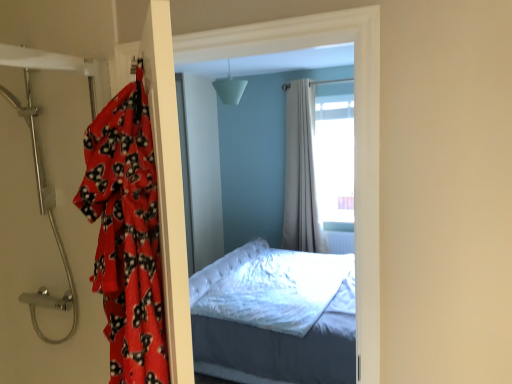
Question: From the image's perspective, is fluffy red blanket at left below beige fabric curtain at center?

Choices:
 (A) no
 (B) yes

Answer: (B)

Question: Can you confirm if fluffy red blanket at left is thinner than beige fabric curtain at center?

Choices:
 (A) yes
 (B) no

Answer: (B)

Question: Is fluffy red blanket at left not within beige fabric curtain at center?

Choices:
 (A) yes
 (B) no

Answer: (A)

Question: Considering the relative sizes of fluffy red blanket at left and beige fabric curtain at center in the image provided, is fluffy red blanket at left shorter than beige fabric curtain at center?

Choices:
 (A) no
 (B) yes

Answer: (B)

Question: From a real-world perspective, is fluffy red blanket at left located higher than beige fabric curtain at center?

Choices:
 (A) yes
 (B) no

Answer: (A)

Question: Considering the relative positions of fluffy red blanket at left and metallic showerhead at left in the image provided, is fluffy red blanket at left to the left or to the right of metallic showerhead at left?

Choices:
 (A) right
 (B) left

Answer: (A)

Question: Relative to metallic showerhead at left, is fluffy red blanket at left in front or behind?

Choices:
 (A) behind
 (B) front

Answer: (B)

Question: Looking at their shapes, would you say fluffy red blanket at left is wider or thinner than metallic showerhead at left?

Choices:
 (A) thin
 (B) wide

Answer: (A)

Question: Is point [x=101, y=208] positioned closer to the camera than point [x=65, y=327]?

Choices:
 (A) closer
 (B) farther

Answer: (A)

Question: From their relative heights in the image, would you say metallic showerhead at left is taller or shorter than beige fabric curtain at center?

Choices:
 (A) short
 (B) tall

Answer: (A)

Question: Is metallic showerhead at left wider or thinner than beige fabric curtain at center?

Choices:
 (A) wide
 (B) thin

Answer: (A)

Question: From the image's perspective, is metallic showerhead at left above or below beige fabric curtain at center?

Choices:
 (A) below
 (B) above

Answer: (A)

Question: Looking at the image, does metallic showerhead at left seem bigger or smaller compared to beige fabric curtain at center?

Choices:
 (A) big
 (B) small

Answer: (B)

Question: From a real-world perspective, is fluffy red blanket at left physically located above or below beige fabric curtain at center?

Choices:
 (A) above
 (B) below

Answer: (A)

Question: Is point (125, 382) positioned closer to the camera than point (287, 130)?

Choices:
 (A) farther
 (B) closer

Answer: (B)